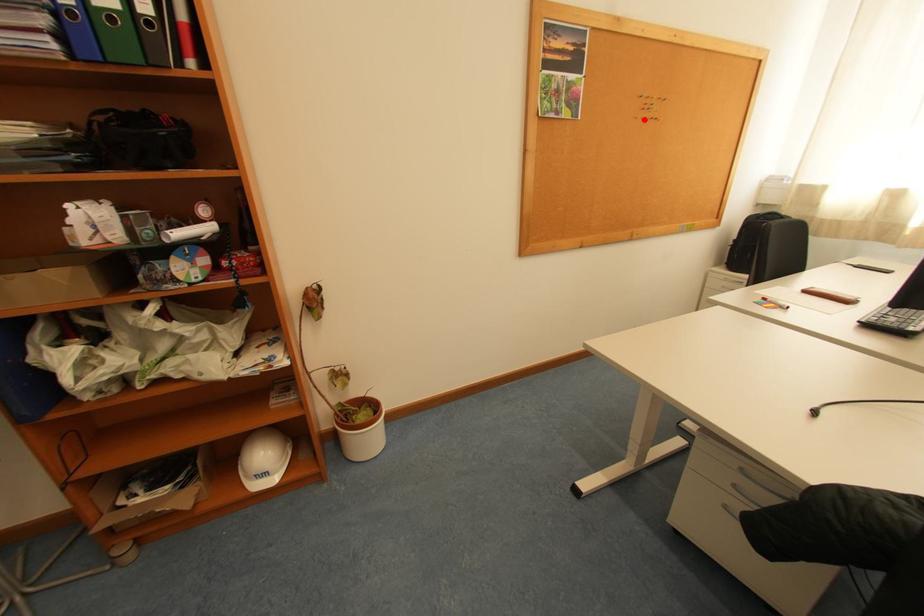
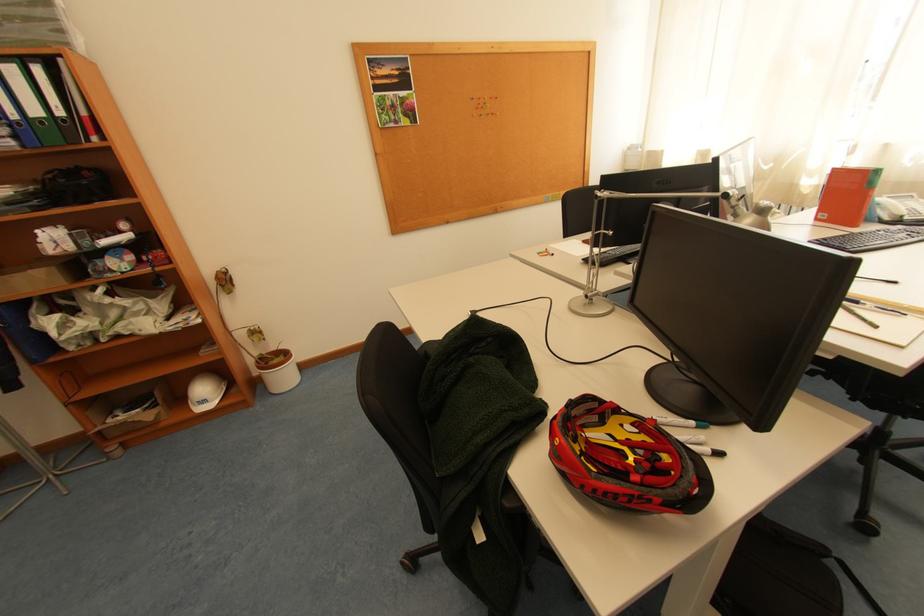
Find the pixel in the second image that matches the highlighted location in the first image.

(481, 118)